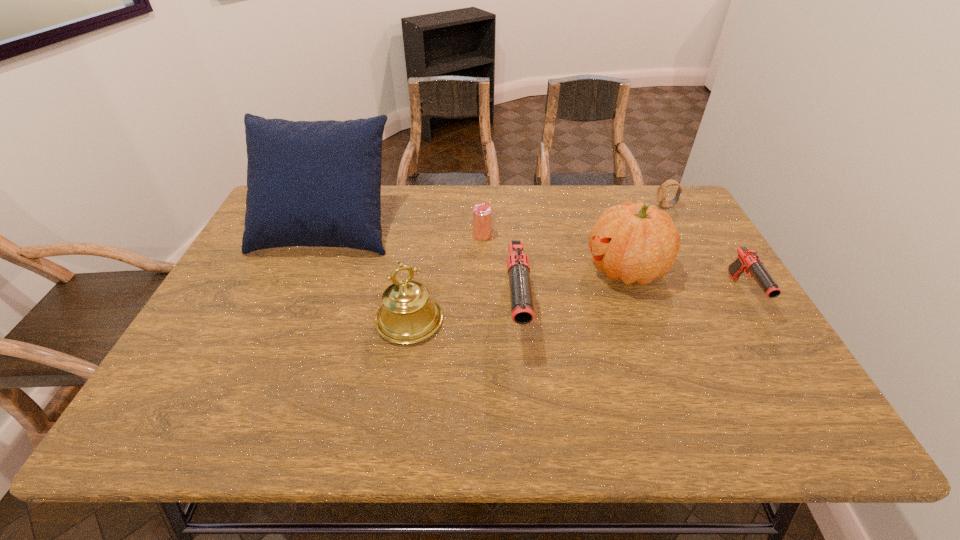
Locate an element on the screen. blank area located 0.200m on the back of the beer can is located at coordinates (482, 194).

In order to click on vacant space situated on the left of the bell in this screenshot , I will do `click(300, 320)`.

This screenshot has height=540, width=960. Identify the location of cushion at the far edge. (310, 183).

You are a GUI agent. You are given a task and a screenshot of the screen. Output one action in this format:
    pyautogui.click(x=<x>, y=<y>)
    Task: Click on the watch at the far edge
    The width and height of the screenshot is (960, 540).
    Given the screenshot: What is the action you would take?
    pyautogui.click(x=662, y=190)

Where is `object that is positioned at the left edge`? The image size is (960, 540). object that is positioned at the left edge is located at coordinates (310, 183).

What are the coordinates of `gun at the right edge` in the screenshot? It's located at (748, 260).

You are a GUI agent. You are given a task and a screenshot of the screen. Output one action in this format:
    pyautogui.click(x=<x>, y=<y>)
    Task: Click on the watch situated at the right edge
    
    Given the screenshot: What is the action you would take?
    pyautogui.click(x=662, y=190)

Identify the location of object present at the far left corner. 310,183.

This screenshot has height=540, width=960. I want to click on object that is at the far right corner, so click(662, 190).

Identify the location of vacant space at the far edge of the desktop. (423, 210).